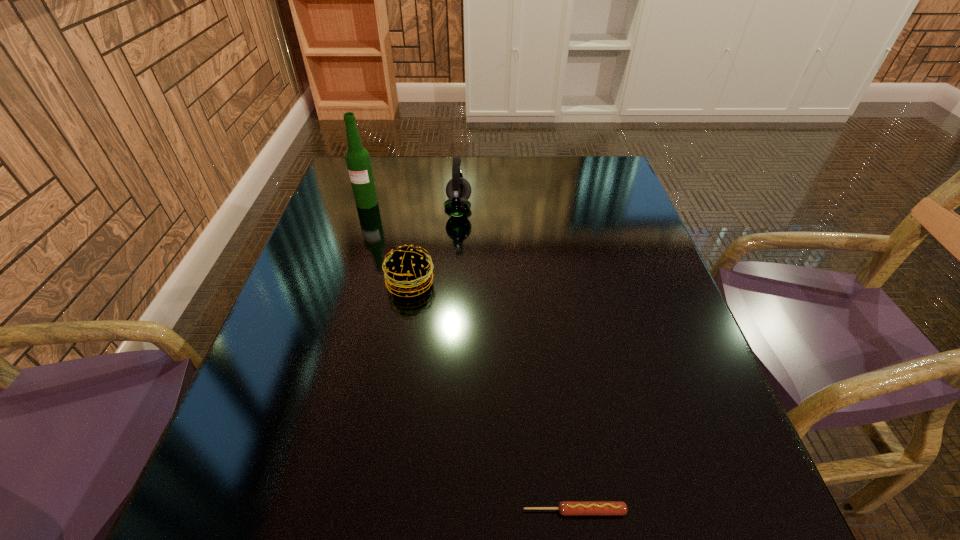
Identify the location of vacant space at the right edge. (681, 325).

I want to click on free region at the near left corner, so click(210, 490).

Locate an element on the screen. This screenshot has width=960, height=540. empty space between the leftmost object and the third object from left to right is located at coordinates (413, 206).

The image size is (960, 540). Find the location of `unoccupied area between the headset and the leftmost object`. unoccupied area between the headset and the leftmost object is located at coordinates (413, 206).

This screenshot has width=960, height=540. In order to click on vacant region between the patty and the tallest object in this screenshot , I will do `click(389, 243)`.

What are the coordinates of `free spot between the second nearest object and the nearest object` in the screenshot? It's located at (492, 397).

The image size is (960, 540). I want to click on free spot between the patty and the beer bottle, so click(389, 243).

What are the coordinates of `vacant area that lies between the tallest object and the third tallest object` in the screenshot? It's located at (389, 243).

I want to click on blank region between the second nearest object and the rightmost object, so click(492, 397).

Where is `unoccupied area between the second object from left to right and the third shortest object`? unoccupied area between the second object from left to right and the third shortest object is located at coordinates (435, 246).